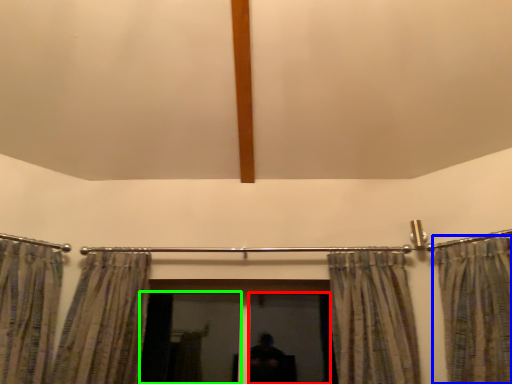
Question: Based on their relative distances, which object is nearer to screen door (highlighted by a red box)? Choose from curtain (highlighted by a blue box) and screen door (highlighted by a green box).

Choices:
 (A) curtain
 (B) screen door

Answer: (B)